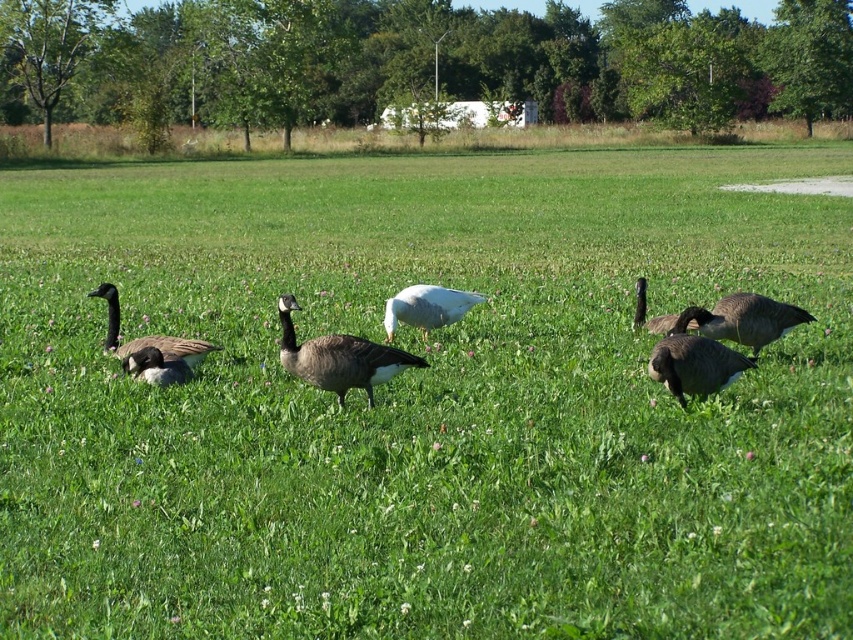
Question: Which object is closer to the camera taking this photo?

Choices:
 (A) white matte duck at center
 (B) dark brown feathered goose at right

Answer: (B)

Question: Does dark gray matte goose at center have a greater width compared to white matte duck at center?

Choices:
 (A) yes
 (B) no

Answer: (A)

Question: Does dark gray matte goose at center appear on the left side of dark gray feathered goose at center?

Choices:
 (A) no
 (B) yes

Answer: (B)

Question: Considering the real-world distances, which object is farthest from the gray matte goose at lower left?

Choices:
 (A) dark gray matte duck at lower left
 (B) dark gray feathered goose at center

Answer: (B)

Question: Which object appears farthest from the camera in this image?

Choices:
 (A) white matte duck at center
 (B) dark gray matte goose at center
 (C) gray matte goose at right
 (D) gray matte goose at lower left

Answer: (A)

Question: Is dark gray matte goose at center positioned before dark brown feathered goose at right?

Choices:
 (A) yes
 (B) no

Answer: (A)